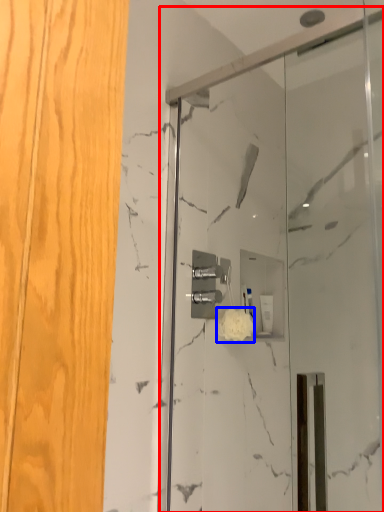
Question: Which of the following is the closest to the observer, screen door (highlighted by a red box) or flower (highlighted by a blue box)?

Choices:
 (A) screen door
 (B) flower

Answer: (A)